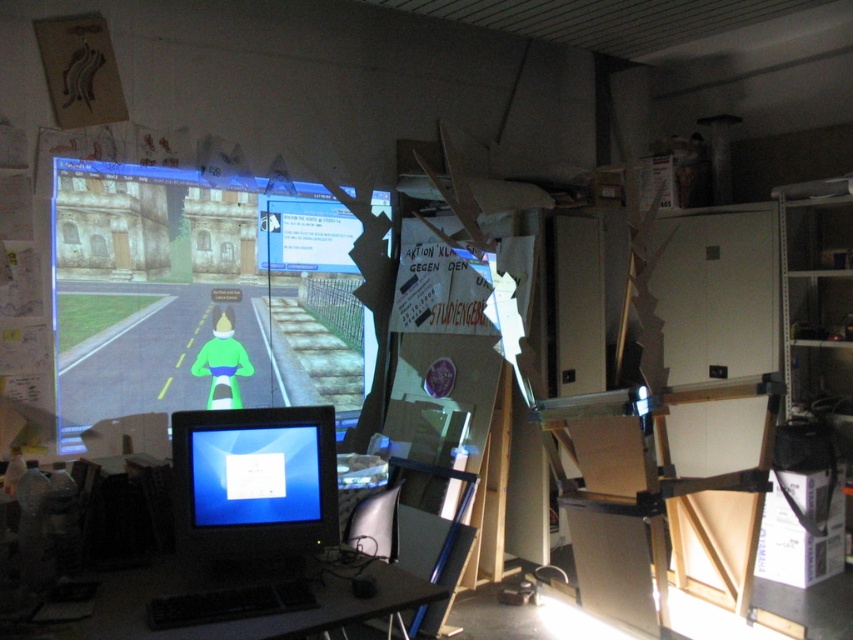
You are navigating a virtual environment displayed on the projection screen. You see two points marked on the screen at coordinates point (311, 522) and point (13, 637). Which point is closer to the viewer?

Point (13, 637) is closer to the viewer because it is in front of point (311, 522) according to the spatial arrangement described.

You are a technician standing 1.5 meters away from the camera position. You need to reach the matte black monitor at lower left to adjust its settings. Can you reach it without moving your position?

The matte black monitor at lower left is 2.10 meters away from the camera. Since you are 1.5 meters away from the camera, the total distance between you and the monitor is 2.10 meters minus 1.5 meters, which equals 0.6 meters. Therefore, you can easily reach the matte black monitor at lower left without moving your position.